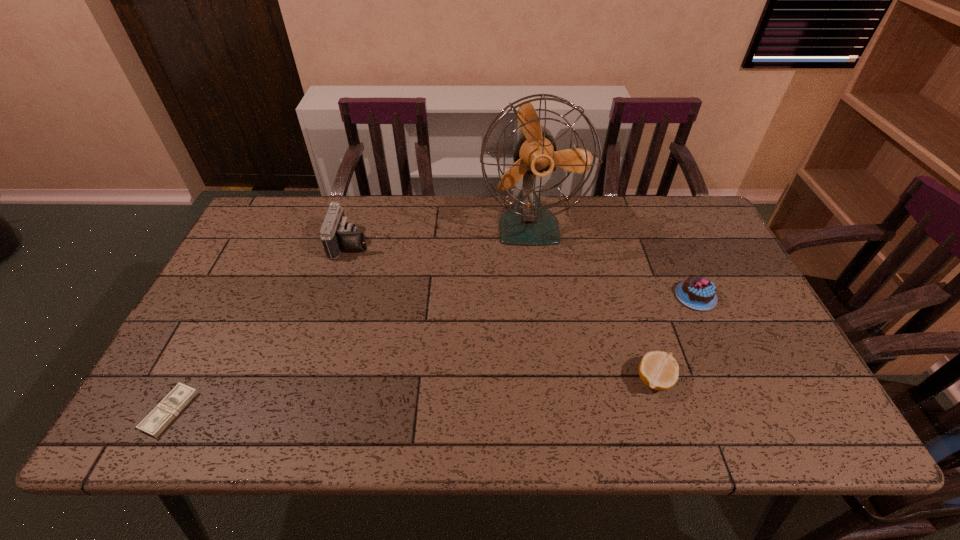
Find the location of a particular element. This screenshot has width=960, height=540. vacant position in the image that satisfies the following two spatial constraints: 1. on the front-facing side of the fan for air flow; 2. at the front of the fourth shortest object with an open lens cover is located at coordinates (532, 242).

Identify the location of vacant area in the image that satisfies the following two spatial constraints: 1. on the front-facing side of the tallest object for air flow; 2. on the left side of the chocolate cake. This screenshot has width=960, height=540. (539, 296).

Where is `free location that satisfies the following two spatial constraints: 1. on the back side of the chocolate cake; 2. on the left side of the shortest object`? Image resolution: width=960 pixels, height=540 pixels. free location that satisfies the following two spatial constraints: 1. on the back side of the chocolate cake; 2. on the left side of the shortest object is located at coordinates (230, 296).